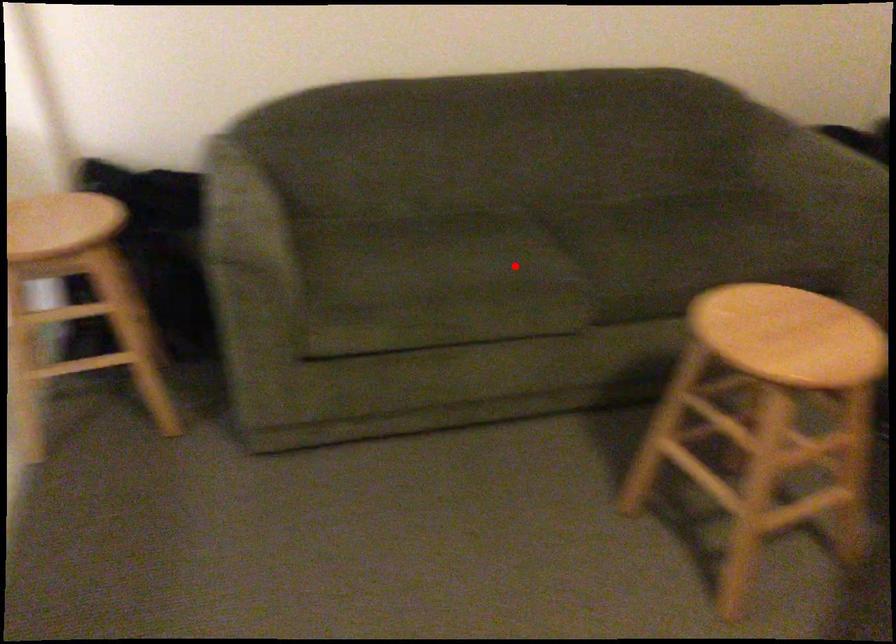
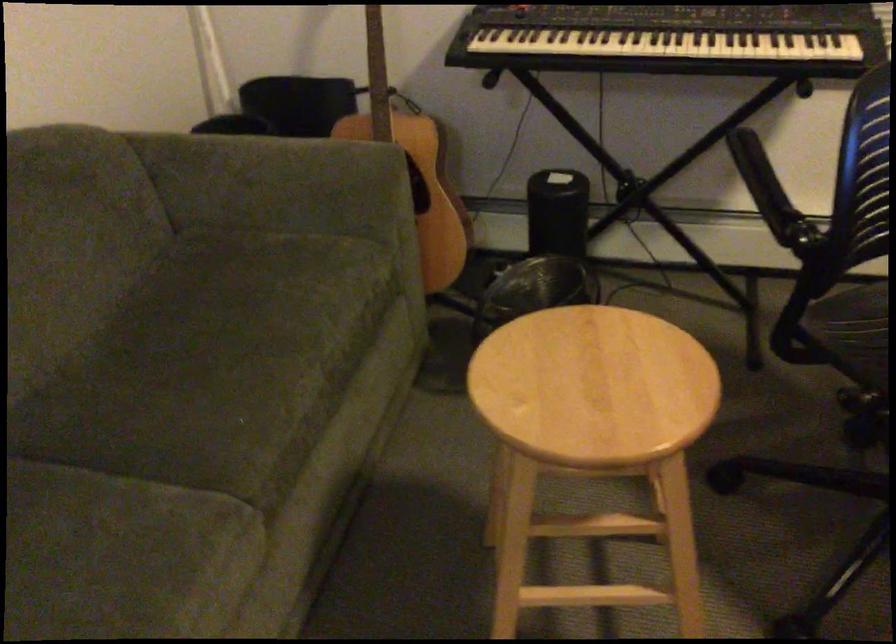
The point at the highlighted location is marked in the first image. Where is the corresponding point in the second image?

(122, 556)